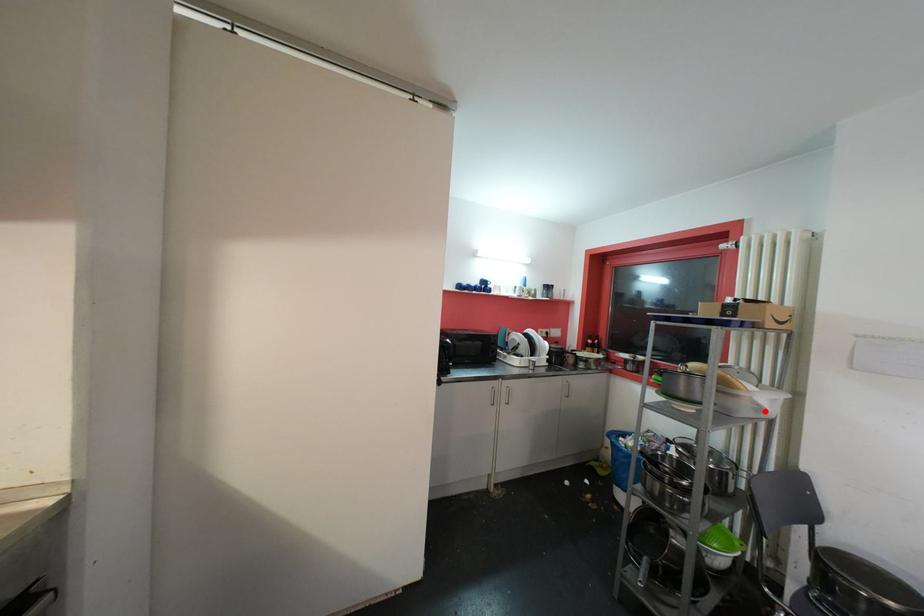
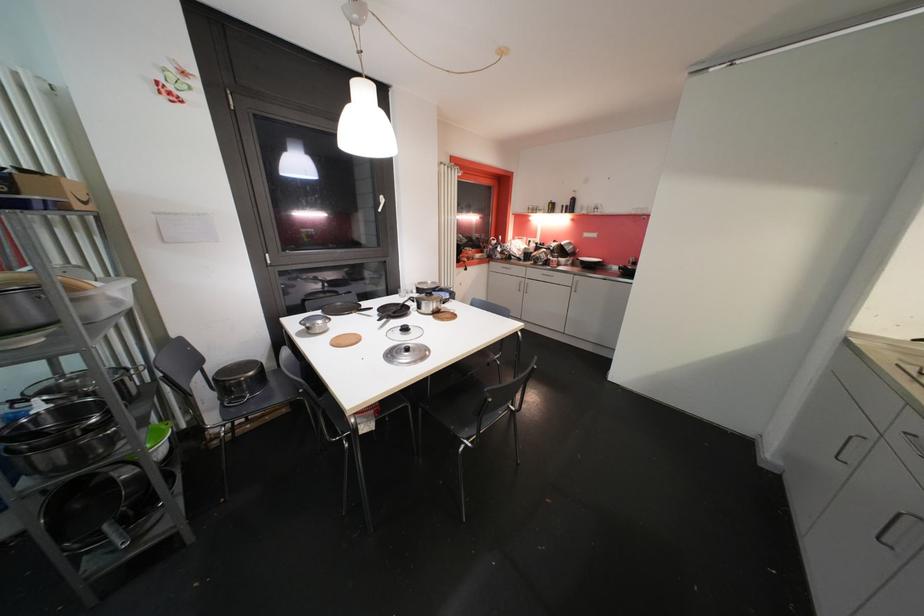
The point at the highlighted location is marked in the first image. Where is the corresponding point in the second image?

(122, 305)